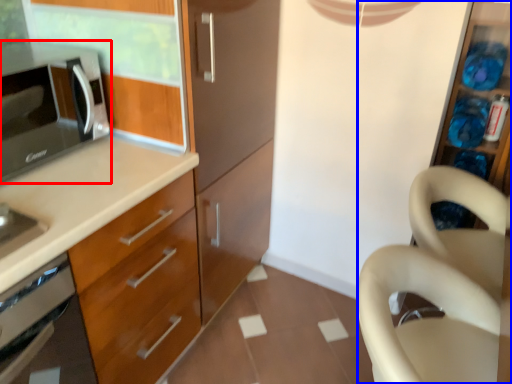
Question: Among these objects, which one is nearest to the camera, microwave oven (highlighted by a red box) or dresser (highlighted by a blue box)?

Choices:
 (A) microwave oven
 (B) dresser

Answer: (A)